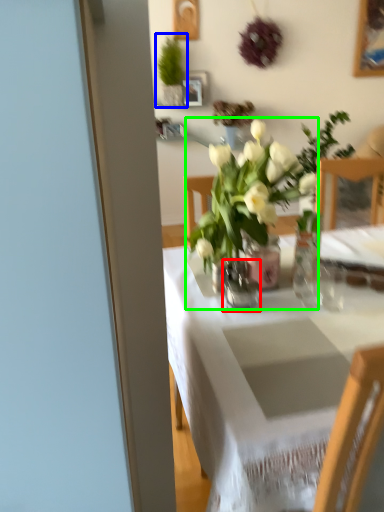
Question: Which object is the farthest from vase (highlighted by a red box)? Choose among these: houseplant (highlighted by a blue box) or houseplant (highlighted by a green box).

Choices:
 (A) houseplant
 (B) houseplant

Answer: (A)